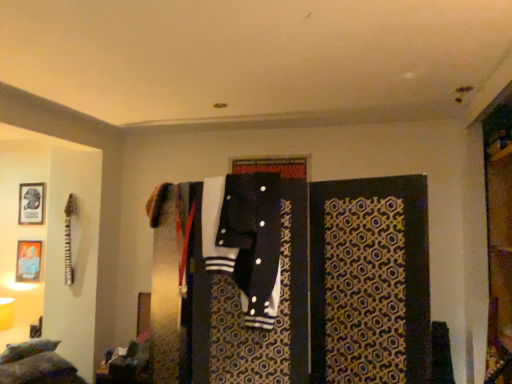
Describe the element at coordinates (28, 261) in the screenshot. I see `matte gold picture frame at upper left, the 1th picture frame when ordered from bottom to top` at that location.

At what (x,y) coordinates should I click in order to perform the action: click on metallic silver picture frame at upper left, which is the second picture frame from bottom to top. Please return your answer as a coordinate pair (x, y). Looking at the image, I should click on (31, 203).

The image size is (512, 384). In order to click on black fabric closet at center in this screenshot , I will do `click(300, 277)`.

Based on the photo, is black fabric closet at center further to the viewer compared to matte gold picture frame at upper left, the 1th picture frame when ordered from bottom to top?

No, it is in front of matte gold picture frame at upper left, the 1th picture frame when ordered from bottom to top.

Considering the positions of objects black fabric closet at center and matte gold picture frame at upper left, which is the second picture frame in top-to-bottom order, in the image provided, who is more to the left, black fabric closet at center or matte gold picture frame at upper left, which is the second picture frame in top-to-bottom order,?

Positioned to the left is matte gold picture frame at upper left, which is the second picture frame in top-to-bottom order.

Is black fabric closet at center wider than matte gold picture frame at upper left, the 1th picture frame when ordered from bottom to top?

Indeed, black fabric closet at center has a greater width compared to matte gold picture frame at upper left, the 1th picture frame when ordered from bottom to top.

From the image's perspective, relative to matte gold picture frame at upper left, which is the second picture frame in top-to-bottom order, is black fabric closet at center above or below?

black fabric closet at center is situated higher than matte gold picture frame at upper left, which is the second picture frame in top-to-bottom order, in the image.

Is matte gold picture frame at upper left, the 1th picture frame when ordered from bottom to top, bigger or smaller than black cotton jacket at center?

Considering their sizes, matte gold picture frame at upper left, the 1th picture frame when ordered from bottom to top, takes up less space than black cotton jacket at center.

Does matte gold picture frame at upper left, the 1th picture frame when ordered from bottom to top, have a greater height compared to black cotton jacket at center?

No, matte gold picture frame at upper left, the 1th picture frame when ordered from bottom to top, is not taller than black cotton jacket at center.

Which is closer, (24, 268) or (261, 174)?

Point (24, 268).

Can you see matte gold picture frame at upper left, which is the second picture frame in top-to-bottom order, touching black cotton jacket at center?

No, matte gold picture frame at upper left, which is the second picture frame in top-to-bottom order, is not next to black cotton jacket at center.

Based on the photo, is fluffy multicolored pillows at lower left wider than black fabric closet at center?

Yes.

Can you tell me how much fluffy multicolored pillows at lower left and black fabric closet at center differ in facing direction?

There is a 79.5-degree angle between the facing directions of fluffy multicolored pillows at lower left and black fabric closet at center.

I want to click on bed behind the black fabric closet at center, so click(x=36, y=364).

From the image's perspective, is fluffy multicolored pillows at lower left located beneath black fabric closet at center?

Yes, from the image's perspective, fluffy multicolored pillows at lower left is below black fabric closet at center.

Which is behind, point (254, 286) or point (29, 197)?

The point (29, 197) is behind.

Looking at the image, does black cotton jacket at center seem bigger or smaller compared to metallic silver picture frame at upper left, which ranks as the first picture frame in top-to-bottom order?

Clearly, black cotton jacket at center is larger in size than metallic silver picture frame at upper left, which ranks as the first picture frame in top-to-bottom order.

Could you tell me if black cotton jacket at center is facing metallic silver picture frame at upper left, which ranks as the first picture frame in top-to-bottom order?

No, black cotton jacket at center does not turn towards metallic silver picture frame at upper left, which ranks as the first picture frame in top-to-bottom order.

Would you say fluffy multicolored pillows at lower left contains black cotton jacket at center?

No, black cotton jacket at center is not surrounded by fluffy multicolored pillows at lower left.

Which of these two, fluffy multicolored pillows at lower left or black cotton jacket at center, stands taller?

Standing taller between the two is black cotton jacket at center.

Is black cotton jacket at center at the back of fluffy multicolored pillows at lower left?

fluffy multicolored pillows at lower left does not have its back to black cotton jacket at center.

From a real-world perspective, which is physically above, fluffy multicolored pillows at lower left or black cotton jacket at center?

From a 3D spatial view, black cotton jacket at center is above.

Would you say fluffy multicolored pillows at lower left is part of black fabric closet at center's contents?

No, black fabric closet at center does not contain fluffy multicolored pillows at lower left.

From the picture: Which point is more distant from viewer, (280, 250) or (33, 378)?

The point (33, 378) is farther from the camera.

Are black fabric closet at center and fluffy multicolored pillows at lower left far apart?

Indeed, black fabric closet at center is not near fluffy multicolored pillows at lower left.

How far apart are black fabric closet at center and fluffy multicolored pillows at lower left?

black fabric closet at center and fluffy multicolored pillows at lower left are 5.20 feet apart.

Between black fabric closet at center and black cotton jacket at center, which one has larger width?

black fabric closet at center is wider.

Which is correct: black fabric closet at center is inside black cotton jacket at center, or outside of it?

black fabric closet at center is located beyond the bounds of black cotton jacket at center.

Is point (332, 292) closer or farther from the camera than point (262, 310)?

Clearly, point (332, 292) is closer to the camera than point (262, 310).

Is black fabric closet at center facing towards black cotton jacket at center?

Yes, black fabric closet at center is turned towards black cotton jacket at center.

This screenshot has width=512, height=384. I want to click on picture frame below the black fabric closet at center (from the image's perspective), so click(28, 261).

At what (x,y) coordinates should I click in order to perform the action: click on clothing that appears in front of the matte gold picture frame at upper left, the 1th picture frame when ordered from bottom to top. Please return your answer as a coordinate pair (x, y). Looking at the image, I should click on (253, 240).

Based on the photo, based on their spatial positions, is black fabric closet at center or fluffy multicolored pillows at lower left further from matte gold picture frame at upper left, which is the second picture frame in top-to-bottom order?

black fabric closet at center lies further to matte gold picture frame at upper left, which is the second picture frame in top-to-bottom order, than the other object.

Looking at the image, which one is located closer to metallic silver picture frame at upper left, which is the second picture frame from bottom to top, black fabric closet at center or fluffy multicolored pillows at lower left?

Among the two, fluffy multicolored pillows at lower left is located nearer to metallic silver picture frame at upper left, which is the second picture frame from bottom to top.

Which object lies further to the anchor point metallic silver picture frame at upper left, which ranks as the first picture frame in top-to-bottom order, black fabric closet at center or matte gold picture frame at upper left, which is the second picture frame in top-to-bottom order?

The object further to metallic silver picture frame at upper left, which ranks as the first picture frame in top-to-bottom order, is black fabric closet at center.

From the image, which object appears to be nearer to matte gold picture frame at upper left, which is the second picture frame in top-to-bottom order, fluffy multicolored pillows at lower left or black cotton jacket at center?

fluffy multicolored pillows at lower left is closer to matte gold picture frame at upper left, which is the second picture frame in top-to-bottom order.

Looking at the image, which one is located closer to fluffy multicolored pillows at lower left, matte gold picture frame at upper left, the 1th picture frame when ordered from bottom to top, or black cotton jacket at center?

Among the two, matte gold picture frame at upper left, the 1th picture frame when ordered from bottom to top, is located nearer to fluffy multicolored pillows at lower left.

Based on their spatial positions, is metallic silver picture frame at upper left, which ranks as the first picture frame in top-to-bottom order, or black fabric closet at center closer to fluffy multicolored pillows at lower left?

Based on the image, metallic silver picture frame at upper left, which ranks as the first picture frame in top-to-bottom order, appears to be nearer to fluffy multicolored pillows at lower left.

Based on their spatial positions, is fluffy multicolored pillows at lower left or black fabric closet at center closer to metallic silver picture frame at upper left, which is the second picture frame from bottom to top?

fluffy multicolored pillows at lower left is closer to metallic silver picture frame at upper left, which is the second picture frame from bottom to top.

Considering their positions, is fluffy multicolored pillows at lower left positioned further to black cotton jacket at center than metallic silver picture frame at upper left, which ranks as the first picture frame in top-to-bottom order?

The object further to black cotton jacket at center is metallic silver picture frame at upper left, which ranks as the first picture frame in top-to-bottom order.

The image size is (512, 384). In order to click on picture frame positioned between black fabric closet at center and metallic silver picture frame at upper left, which ranks as the first picture frame in top-to-bottom order, from near to far in this screenshot , I will do `click(28, 261)`.

Where is `bed located between black cotton jacket at center and matte gold picture frame at upper left, which is the second picture frame in top-to-bottom order, in the depth direction`? bed located between black cotton jacket at center and matte gold picture frame at upper left, which is the second picture frame in top-to-bottom order, in the depth direction is located at coordinates (36, 364).

At what (x,y) coordinates should I click in order to perform the action: click on picture frame between fluffy multicolored pillows at lower left and metallic silver picture frame at upper left, which is the second picture frame from bottom to top, in the front-back direction. Please return your answer as a coordinate pair (x, y). Looking at the image, I should click on (28, 261).

The height and width of the screenshot is (384, 512). What are the coordinates of `bed located between black fabric closet at center and metallic silver picture frame at upper left, which is the second picture frame from bottom to top, in the depth direction` in the screenshot? It's located at (36, 364).